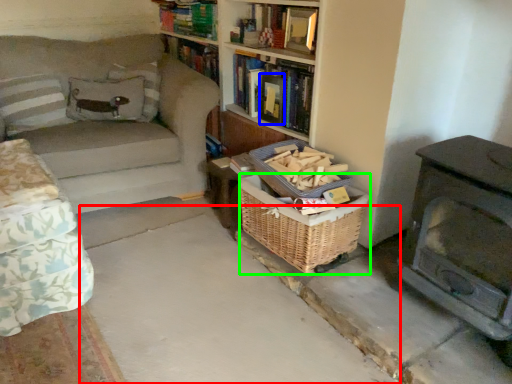
Question: Which object is positioned farthest from concrete (highlighted by a red box)? Select from paperback book (highlighted by a blue box) and basket (highlighted by a green box).

Choices:
 (A) paperback book
 (B) basket

Answer: (A)